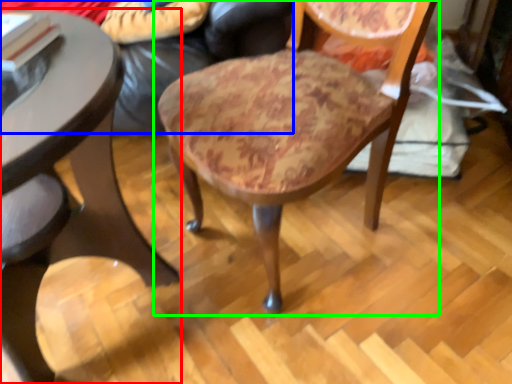
Question: Based on their relative distances, which object is farther from table (highlighted by a red box)? Choose from couch (highlighted by a blue box) and chair (highlighted by a green box).

Choices:
 (A) couch
 (B) chair

Answer: (A)